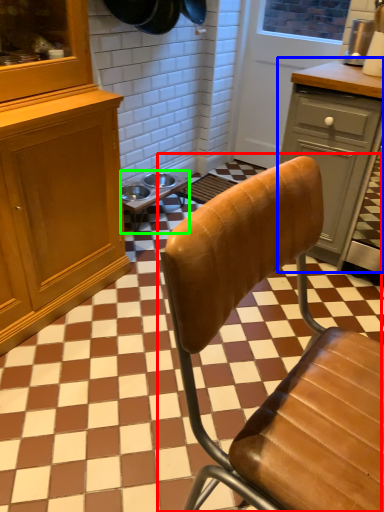
Question: Considering the real-world distances, which object is closest to chair (highlighted by a red box)? cabinetry (highlighted by a blue box) or table (highlighted by a green box).

Choices:
 (A) cabinetry
 (B) table

Answer: (A)